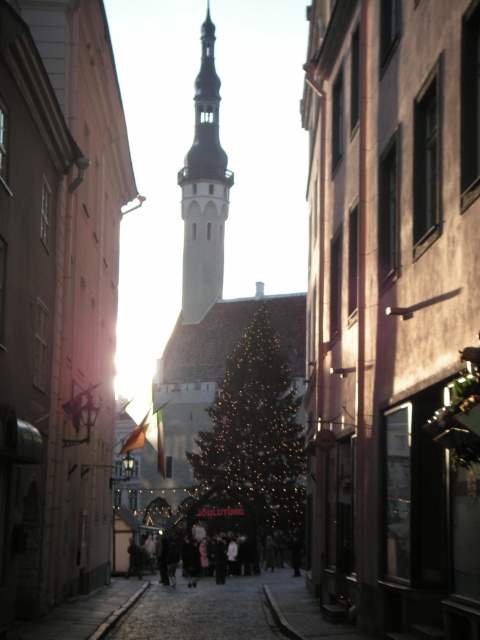
Question: Among these objects, which one is nearest to the camera?

Choices:
 (A) smooth stone bell tower at center
 (B) illuminated gold christmas tree at center
 (C) dark clothing at center

Answer: (C)

Question: Among these objects, which one is nearest to the camera?

Choices:
 (A) smooth stone bell tower at center
 (B) illuminated gold christmas tree at center
 (C) dark clothing at center

Answer: (C)

Question: Is illuminated gold christmas tree at center smaller than smooth stone bell tower at center?

Choices:
 (A) no
 (B) yes

Answer: (B)

Question: Does smooth stone bell tower at center have a larger size compared to dark clothing at center?

Choices:
 (A) yes
 (B) no

Answer: (A)

Question: Is smooth stone bell tower at center above dark clothing at center?

Choices:
 (A) yes
 (B) no

Answer: (A)

Question: Estimate the real-world distances between objects in this image. Which object is closer to the smooth stone bell tower at center?

Choices:
 (A) illuminated gold christmas tree at center
 (B) dark clothing at center

Answer: (A)